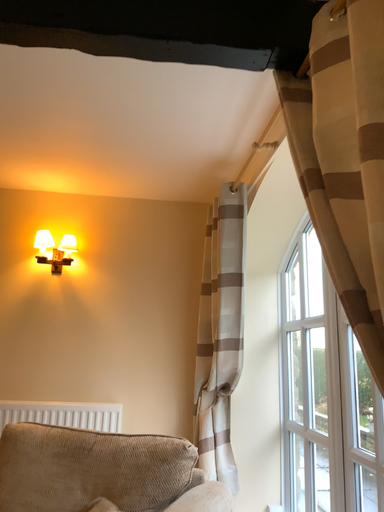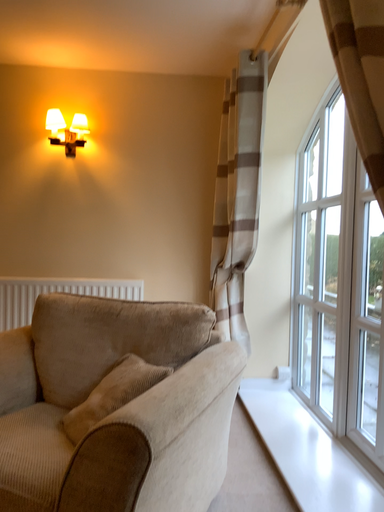
Question: How did the camera likely rotate when shooting the video?

Choices:
 (A) rotated downward
 (B) rotated upward

Answer: (A)